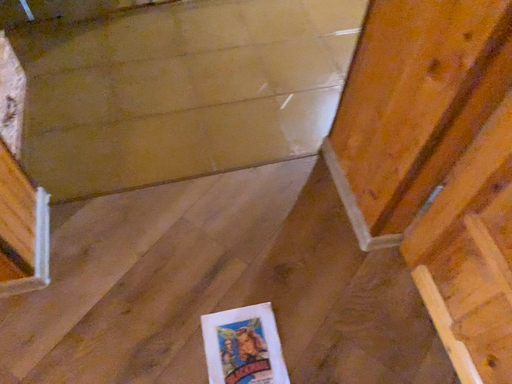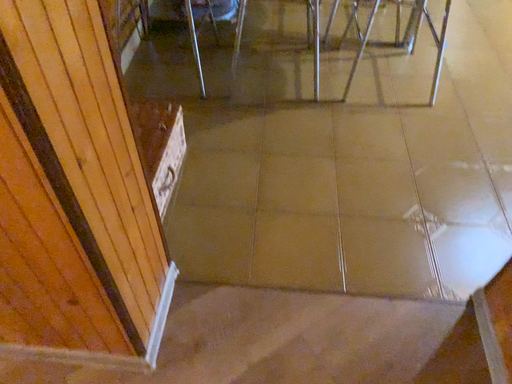
Question: How did the camera likely rotate when shooting the video?

Choices:
 (A) rotated upward
 (B) rotated downward

Answer: (A)